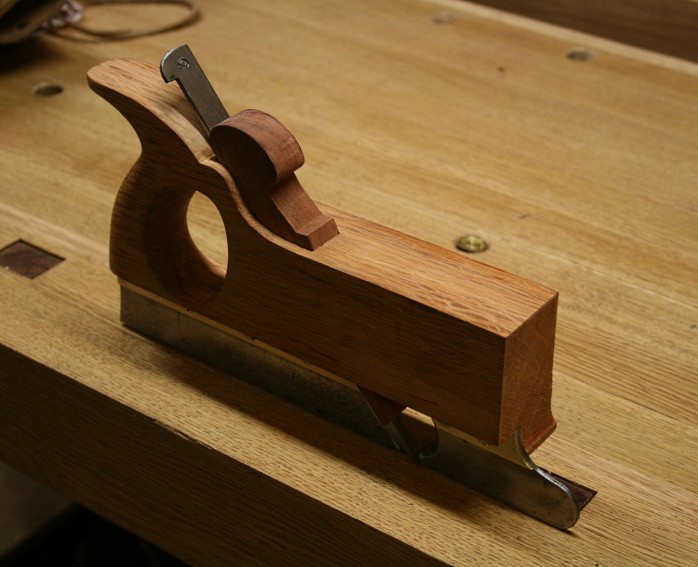
Identify the location of wood table top. The width and height of the screenshot is (698, 567). (101, 349).